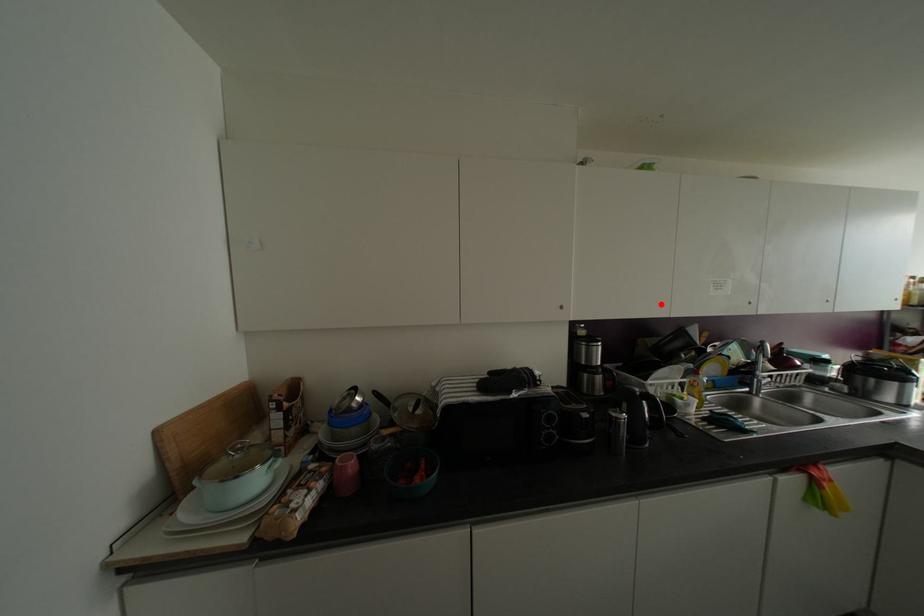
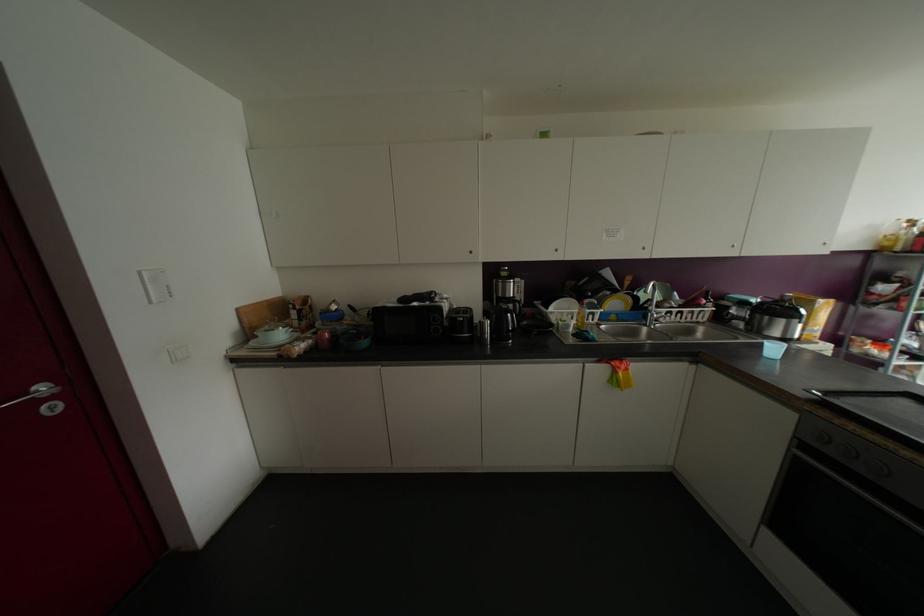
Where in the second image is the point corresponding to the highlighted location from the first image?

(555, 249)